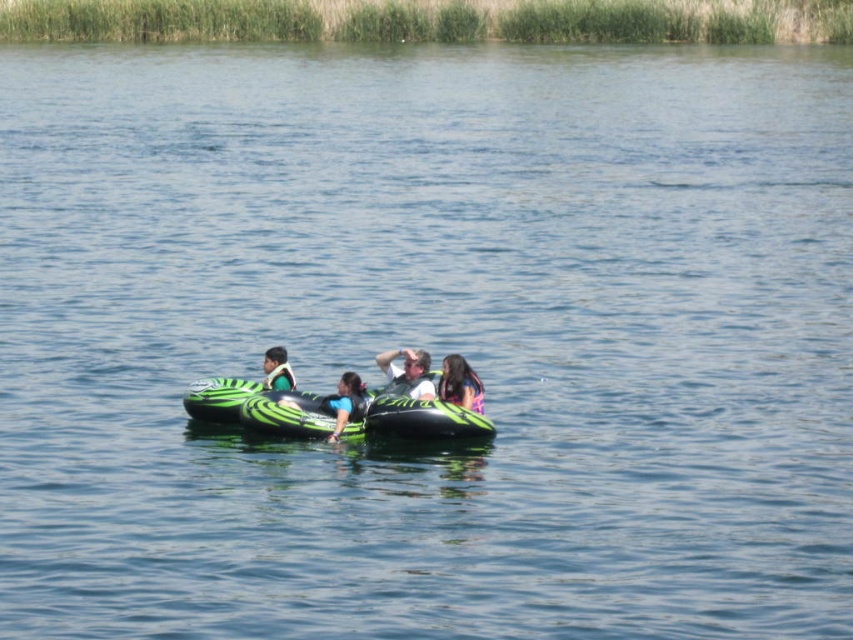
Question: Among these points, which one is nearest to the camera?

Choices:
 (A) (413, 392)
 (B) (468, 401)
 (C) (345, 376)

Answer: (B)

Question: From the image, what is the correct spatial relationship of matte green life vest at center in relation to green rubber tube at center?

Choices:
 (A) right
 (B) left

Answer: (A)

Question: Which of the following is the farthest from the observer?

Choices:
 (A) (274, 349)
 (B) (334, 440)
 (C) (376, 394)
 (D) (450, 400)

Answer: (A)

Question: Is matte green life vest at center smaller than green rubber tube at center?

Choices:
 (A) no
 (B) yes

Answer: (A)

Question: Which is farther from the blue fabric life vest at center?

Choices:
 (A) matte green life vest at center
 (B) multicolored fabric hair at center

Answer: (B)

Question: Does green inflatable tube at center appear over multicolored fabric hair at center?

Choices:
 (A) no
 (B) yes

Answer: (A)